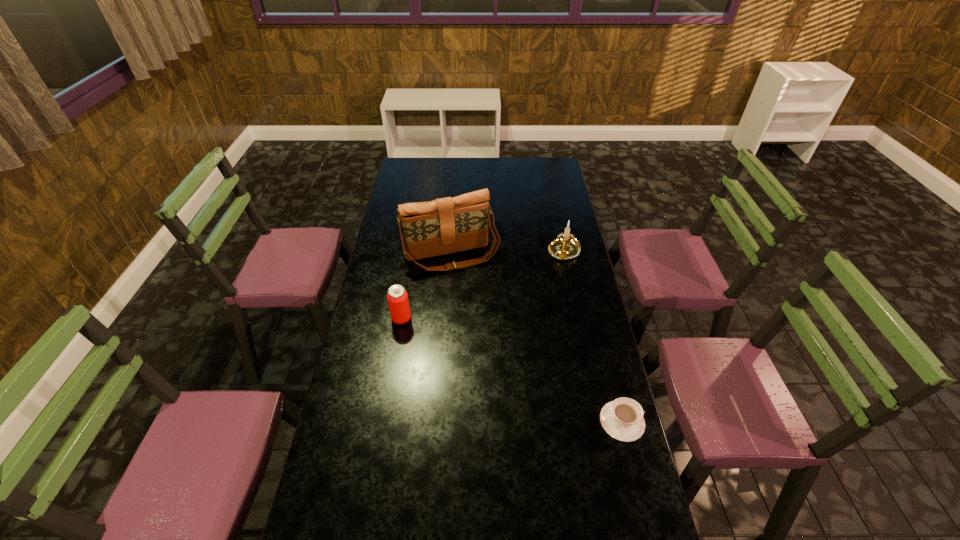
At what (x,y) coordinates should I click in order to perform the action: click on free space located 0.170m on the handle side of the candle holder. Please return your answer as a coordinate pair (x, y). Looking at the image, I should click on (538, 285).

Where is `vacant area situated 0.360m on the handle side of the candle holder`? The image size is (960, 540). vacant area situated 0.360m on the handle side of the candle holder is located at coordinates (515, 314).

I want to click on beer can present at the left edge, so click(397, 296).

Find the location of a particular element. This screenshot has width=960, height=540. shoulder bag at the left edge is located at coordinates (447, 225).

Locate an element on the screen. teacup that is at the right edge is located at coordinates (622, 419).

At what (x,y) coordinates should I click in order to perform the action: click on candle holder present at the right edge. Please return your answer as a coordinate pair (x, y). Image resolution: width=960 pixels, height=540 pixels. Looking at the image, I should click on (565, 246).

Find the location of a particular element. vacant point at the far edge is located at coordinates (494, 162).

In order to click on free region at the left edge of the desktop in this screenshot , I will do click(x=423, y=201).

At what (x,y) coordinates should I click in order to perform the action: click on free point at the right edge. Please return your answer as a coordinate pair (x, y). This screenshot has width=960, height=540. Looking at the image, I should click on (587, 352).

The height and width of the screenshot is (540, 960). Identify the location of vacant space at the far left corner. (x=405, y=163).